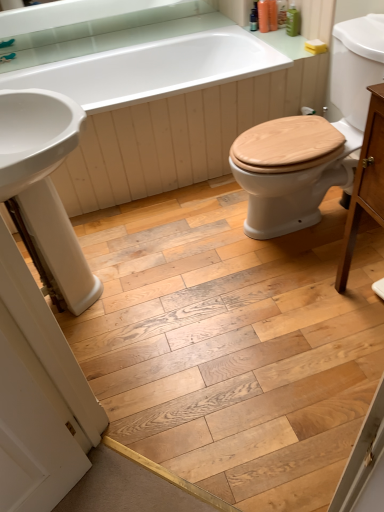
The image size is (384, 512). I want to click on free spot behind light brown wood cabinet at right, so click(336, 266).